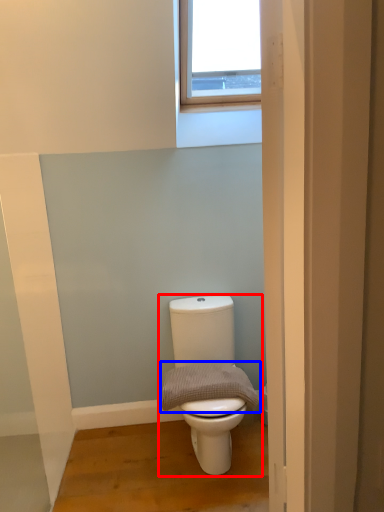
Question: Which object appears farthest to the camera in this image, toilet (highlighted by a red box) or gray (highlighted by a blue box)?

Choices:
 (A) toilet
 (B) gray

Answer: (B)